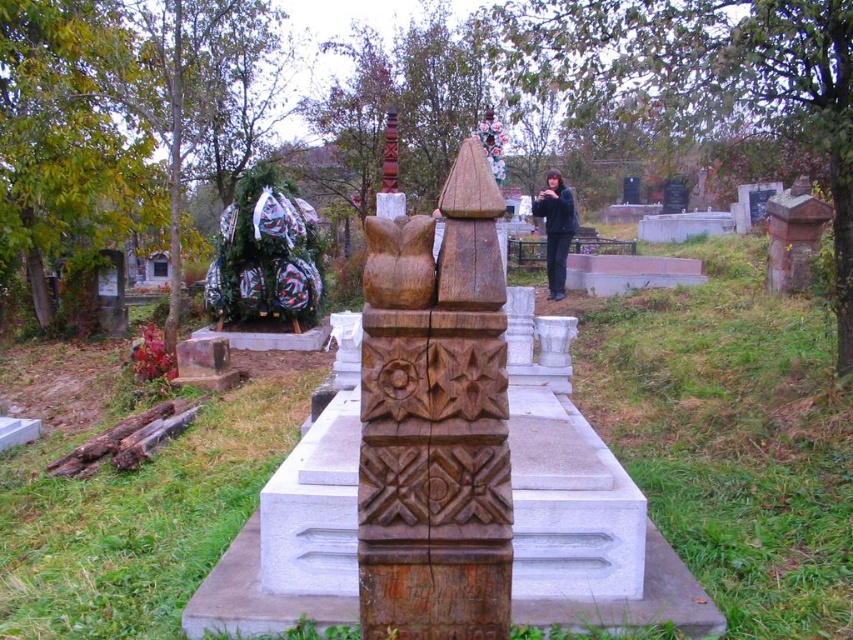
Does wooden carving at center appear under brown wood carving at center?

Correct, wooden carving at center is located below brown wood carving at center.

Is wooden carving at center above brown wood carving at center?

No, wooden carving at center is not above brown wood carving at center.

Identify the location of wooden carving at center. (434, 420).

This screenshot has width=853, height=640. In order to click on wooden carving at center in this screenshot , I will do `click(434, 420)`.

How far apart are wooden carving at center and brown wood totem pole at center?

wooden carving at center is 4.96 meters away from brown wood totem pole at center.

In the scene shown: Who is positioned more to the right, wooden carving at center or brown wood totem pole at center?

wooden carving at center

Image resolution: width=853 pixels, height=640 pixels. In order to click on wooden carving at center in this screenshot , I will do `click(434, 420)`.

Can you confirm if brown wood carving at center is taller than black matte jacket at center?

No, brown wood carving at center is not taller than black matte jacket at center.

At what (x,y) coordinates should I click in order to perform the action: click on brown wood carving at center. Please return your answer as a coordinate pair (x, y). Looking at the image, I should click on (398, 262).